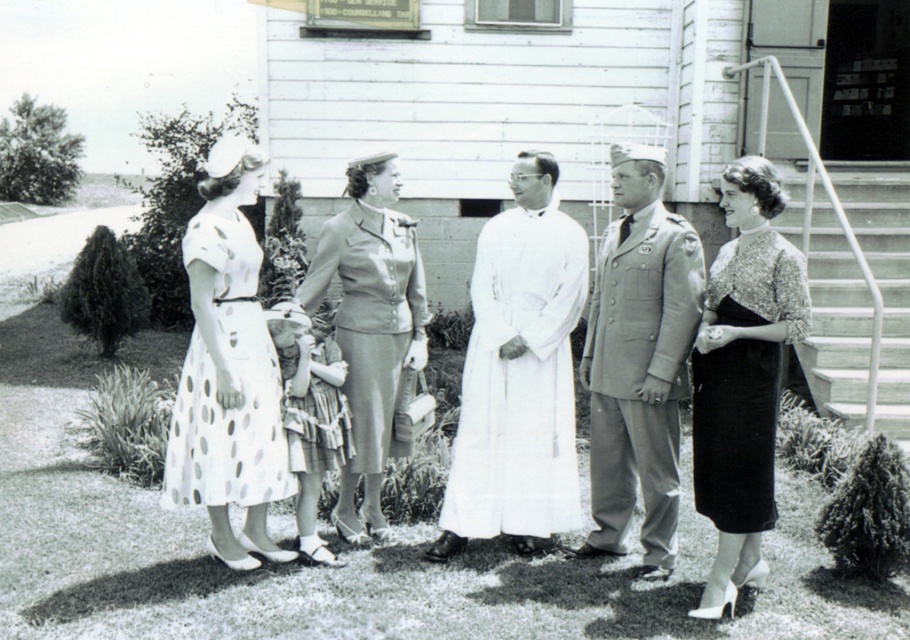
You are a photographer who wants to ensure both the white dotted dress at left and the white cloth robe at center are clearly visible in your photo. Based on their positions, which one might appear larger in the final image?

The white dotted dress at left appears larger because it is closer to the viewer than the white cloth robe at center.

You are standing in front of the building and want to locate the white dotted dress at left. Which direction should you look relative to the center of the image?

The white dotted dress at left is located at point 0.547 on the x axis and 0.296 on the y axis. Since the x coordinate is greater than 0.5, it is to the right of the center of the image.